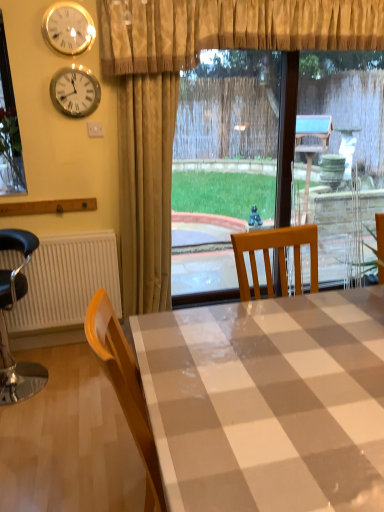
Describe the element at coordinates (268, 402) in the screenshot. I see `white glossy table at center` at that location.

What do you see at coordinates (66, 282) in the screenshot? The height and width of the screenshot is (512, 384). I see `white ribbed radiator at lower left` at bounding box center [66, 282].

Locate an element on the screen. gold textured curtain at upper center, arranged as the first curtain when ordered from the bottom is located at coordinates (146, 188).

Describe the element at coordinates (146, 188) in the screenshot. This screenshot has height=512, width=384. I see `gold textured curtain at upper center, arranged as the first curtain when ordered from the bottom` at that location.

This screenshot has width=384, height=512. Describe the element at coordinates (5, 323) in the screenshot. I see `metallic black chair at left` at that location.

I want to click on gold metallic clock at upper left, the second clock ordered from the bottom, so click(68, 28).

Between metallic black chair at left and gold metallic clock at upper left, positioned as the first clock in top-to-bottom order, which one appears on the right side from the viewer's perspective?

gold metallic clock at upper left, positioned as the first clock in top-to-bottom order.

Is point (21, 366) farther from viewer compared to point (75, 40)?

Yes, it is behind point (75, 40).

Where is `the 2nd clock positioned above the metallic black chair at left (from a real-world perspective)`? The height and width of the screenshot is (512, 384). the 2nd clock positioned above the metallic black chair at left (from a real-world perspective) is located at coordinates (68, 28).

Considering the positions of points (61, 83) and (139, 194), is point (61, 83) closer to camera compared to point (139, 194)?

Yes, it is in front of point (139, 194).

In the scene shown: Is metallic clock at upper left, the first clock in the bottom-to-top sequence, not close to gold textured curtain at upper center, arranged as the first curtain when ordered from the bottom?

metallic clock at upper left, the first clock in the bottom-to-top sequence, is actually quite close to gold textured curtain at upper center, arranged as the first curtain when ordered from the bottom.

Who is smaller, metallic clock at upper left, the first clock in the bottom-to-top sequence, or gold textured curtain at upper center, arranged as the first curtain when ordered from the bottom?

metallic clock at upper left, the first clock in the bottom-to-top sequence.

You are a GUI agent. You are given a task and a screenshot of the screen. Output one action in this format:
    pyautogui.click(x=<x>, y=<y>)
    Task: Click on the curtain below the metallic clock at upper left, the first clock in the bottom-to-top sequence (from a real-world perspective)
    The height and width of the screenshot is (512, 384).
    Given the screenshot: What is the action you would take?
    pyautogui.click(x=146, y=188)

Consider the image. Which object is wider, gold metallic clock at upper left, the second clock ordered from the bottom, or white glossy table at center?

Wider between the two is white glossy table at center.

Is gold metallic clock at upper left, positioned as the first clock in top-to-bottom order, located outside white glossy table at center?

Absolutely, gold metallic clock at upper left, positioned as the first clock in top-to-bottom order, is external to white glossy table at center.

Is gold metallic clock at upper left, positioned as the first clock in top-to-bottom order, in contact with white glossy table at center?

No, gold metallic clock at upper left, positioned as the first clock in top-to-bottom order, is not touching white glossy table at center.

Between gold metallic clock at upper left, the second clock ordered from the bottom, and white glossy table at center, which one has less height?

Standing shorter between the two is gold metallic clock at upper left, the second clock ordered from the bottom.

Looking at this image, is the position of gold textured curtain at upper center, which is the second curtain from top to bottom, less distant than that of white glossy table at center?

No, the depth of gold textured curtain at upper center, which is the second curtain from top to bottom, is greater than that of white glossy table at center.

From the image's perspective, relative to white glossy table at center, is gold textured curtain at upper center, which is the second curtain from top to bottom, above or below?

gold textured curtain at upper center, which is the second curtain from top to bottom, is above white glossy table at center.

From a real-world perspective, which is physically below, white ribbed radiator at lower left or beige textured curtain at upper center, the first curtain viewed from the top?

white ribbed radiator at lower left is physically lower.

Does point (114, 239) come behind point (352, 46)?

That is True.

Is white ribbed radiator at lower left in front of or behind beige textured curtain at upper center, the first curtain viewed from the top, in the image?

white ribbed radiator at lower left is behind beige textured curtain at upper center, the first curtain viewed from the top.

Is white ribbed radiator at lower left completely or partially outside of beige textured curtain at upper center, placed as the 2th curtain when sorted from bottom to top?

Yes, white ribbed radiator at lower left is outside of beige textured curtain at upper center, placed as the 2th curtain when sorted from bottom to top.

Does metallic clock at upper left, which is the second clock in top-to-bottom order, have a greater width compared to gold metallic clock at upper left, the second clock ordered from the bottom?

Incorrect, the width of metallic clock at upper left, which is the second clock in top-to-bottom order, does not surpass that of gold metallic clock at upper left, the second clock ordered from the bottom.

Is metallic clock at upper left, which is the second clock in top-to-bottom order, beside gold metallic clock at upper left, positioned as the first clock in top-to-bottom order?

metallic clock at upper left, which is the second clock in top-to-bottom order, is not next to gold metallic clock at upper left, positioned as the first clock in top-to-bottom order, and they're not touching.

Considering the points (64, 84) and (74, 6), which point is in front, point (64, 84) or point (74, 6)?

The point (74, 6) is closer.

From a real-world perspective, is metallic clock at upper left, the first clock in the bottom-to-top sequence, above or below gold metallic clock at upper left, positioned as the first clock in top-to-bottom order?

metallic clock at upper left, the first clock in the bottom-to-top sequence, is situated lower than gold metallic clock at upper left, positioned as the first clock in top-to-bottom order, in the real world.

Which is behind, gold metallic clock at upper left, positioned as the first clock in top-to-bottom order, or metallic black chair at left?

gold metallic clock at upper left, positioned as the first clock in top-to-bottom order, is further from the camera.

Could you tell me if gold metallic clock at upper left, the second clock ordered from the bottom, is facing metallic black chair at left?

No, gold metallic clock at upper left, the second clock ordered from the bottom, is not aimed at metallic black chair at left.

Where is `chair that appears below the gold metallic clock at upper left, the second clock ordered from the bottom (from the image's perspective)`? This screenshot has height=512, width=384. chair that appears below the gold metallic clock at upper left, the second clock ordered from the bottom (from the image's perspective) is located at coordinates (5, 323).

Identify the location of clock that is the 2nd object located behind the gold textured curtain at upper center, arranged as the first curtain when ordered from the bottom. (75, 91).

Which object lies nearer to the anchor point white ribbed radiator at lower left, gold metallic clock at upper left, positioned as the first clock in top-to-bottom order, or white glossy table at center?

gold metallic clock at upper left, positioned as the first clock in top-to-bottom order.

Considering their positions, is beige textured curtain at upper center, the first curtain viewed from the top, positioned further to metallic black chair at left than gold textured curtain at upper center, which is the second curtain from top to bottom?

Among the two, beige textured curtain at upper center, the first curtain viewed from the top, is located further to metallic black chair at left.

When comparing their distances from metallic black chair at left, does white glossy table at center or gold textured curtain at upper center, which is the second curtain from top to bottom, seem closer?

Among the two, gold textured curtain at upper center, which is the second curtain from top to bottom, is located nearer to metallic black chair at left.

Based on their spatial positions, is gold textured curtain at upper center, which is the second curtain from top to bottom, or white ribbed radiator at lower left closer to metallic black chair at left?

The object closer to metallic black chair at left is white ribbed radiator at lower left.

Estimate the real-world distances between objects in this image. Which object is closer to metallic black chair at left, white glossy table at center or gold metallic clock at upper left, the second clock ordered from the bottom?

Among the two, gold metallic clock at upper left, the second clock ordered from the bottom, is located nearer to metallic black chair at left.

Estimate the real-world distances between objects in this image. Which object is closer to white glossy table at center, metallic black chair at left or gold metallic clock at upper left, positioned as the first clock in top-to-bottom order?

metallic black chair at left.

From the picture: Considering their positions, is metallic clock at upper left, the first clock in the bottom-to-top sequence, positioned further to white glossy table at center than metallic black chair at left?

metallic clock at upper left, the first clock in the bottom-to-top sequence, lies further to white glossy table at center than the other object.

Looking at the image, which one is located closer to metallic black chair at left, beige textured curtain at upper center, the first curtain viewed from the top, or white glossy table at center?

The object closer to metallic black chair at left is white glossy table at center.

Locate an element on the screen. curtain between gold metallic clock at upper left, positioned as the first clock in top-to-bottom order, and metallic black chair at left from top to bottom is located at coordinates (146, 188).

At what (x,y) coordinates should I click in order to perform the action: click on chair between white glossy table at center and gold textured curtain at upper center, arranged as the first curtain when ordered from the bottom, in the front-back direction. Please return your answer as a coordinate pair (x, y). The height and width of the screenshot is (512, 384). Looking at the image, I should click on (5, 323).

The height and width of the screenshot is (512, 384). Identify the location of curtain between metallic clock at upper left, which is the second clock in top-to-bottom order, and metallic black chair at left vertically. (146, 188).

This screenshot has width=384, height=512. In order to click on clock between gold metallic clock at upper left, positioned as the first clock in top-to-bottom order, and white glossy table at center, in the vertical direction in this screenshot , I will do `click(75, 91)`.